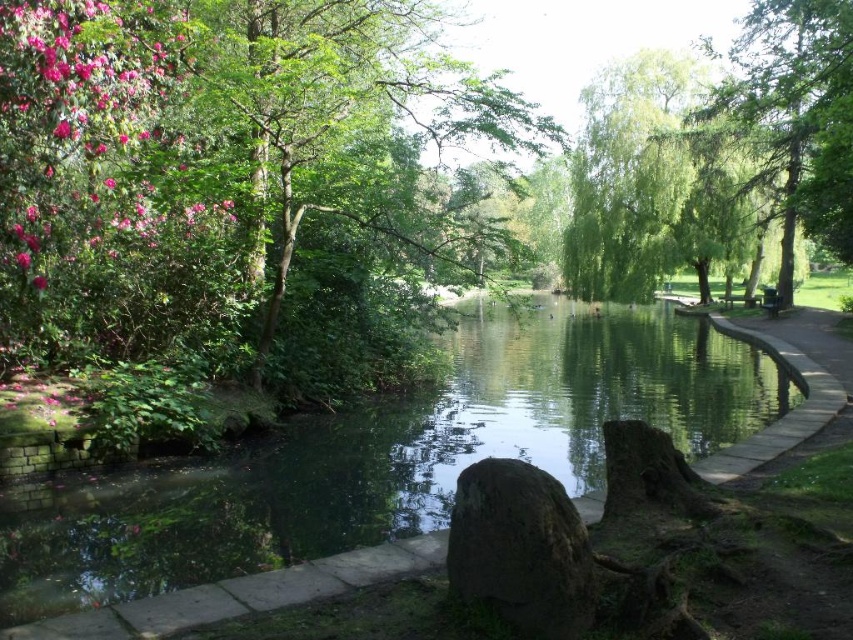
Who is lower down, green mossy rock at center or smooth concrete path at right?

green mossy rock at center is below.

Is point (466, 500) positioned behind point (781, 328)?

No, it is not.

The width and height of the screenshot is (853, 640). In order to click on green mossy rock at center in this screenshot , I will do `click(520, 548)`.

Is green leafy tree at upper left below green smooth water at center?

No.

What do you see at coordinates (213, 161) in the screenshot?
I see `green leafy tree at upper left` at bounding box center [213, 161].

In order to click on green leafy tree at upper left in this screenshot , I will do `click(213, 161)`.

Who is higher up, green leafy tree at right or green mossy rock at center?

green leafy tree at right

Is green leafy tree at right bigger than green mossy rock at center?

Indeed, green leafy tree at right has a larger size compared to green mossy rock at center.

Is point (828, 32) farther from camera compared to point (572, 541)?

Yes.

The width and height of the screenshot is (853, 640). In order to click on green leafy tree at right in this screenshot , I will do `click(792, 118)`.